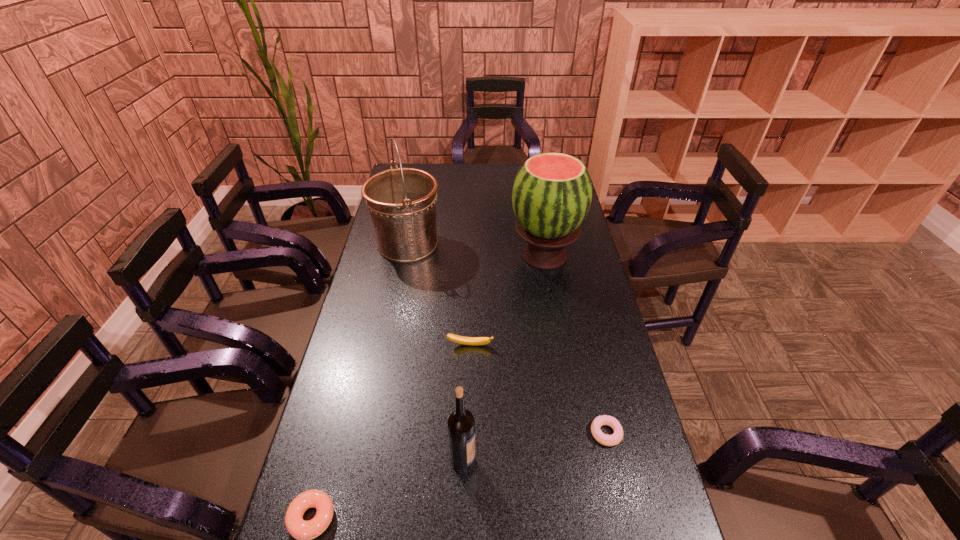
Where is `vacant point located 0.170m on the label of the wine bottle`? This screenshot has width=960, height=540. vacant point located 0.170m on the label of the wine bottle is located at coordinates (544, 461).

This screenshot has width=960, height=540. I want to click on free space located 0.290m at the stem of the third shortest object, so click(468, 438).

I want to click on free spot located 0.130m on the left of the third nearest object, so click(x=540, y=433).

Where is `object that is at the left edge`? object that is at the left edge is located at coordinates (402, 201).

Where is `watermelon at the right edge`? This screenshot has height=540, width=960. watermelon at the right edge is located at coordinates [552, 192].

Locate an element on the screen. doughnut present at the right edge is located at coordinates (608, 440).

Where is `free space at the far edge`? free space at the far edge is located at coordinates (441, 174).

Image resolution: width=960 pixels, height=540 pixels. In the image, there is a desktop. Identify the location of free region at the left edge. (390, 359).

This screenshot has height=540, width=960. In the image, there is a desktop. Find the location of `free region at the right edge`. free region at the right edge is located at coordinates (582, 241).

This screenshot has width=960, height=540. Identify the location of free space between the fourth shortest object and the watermelon. (504, 358).